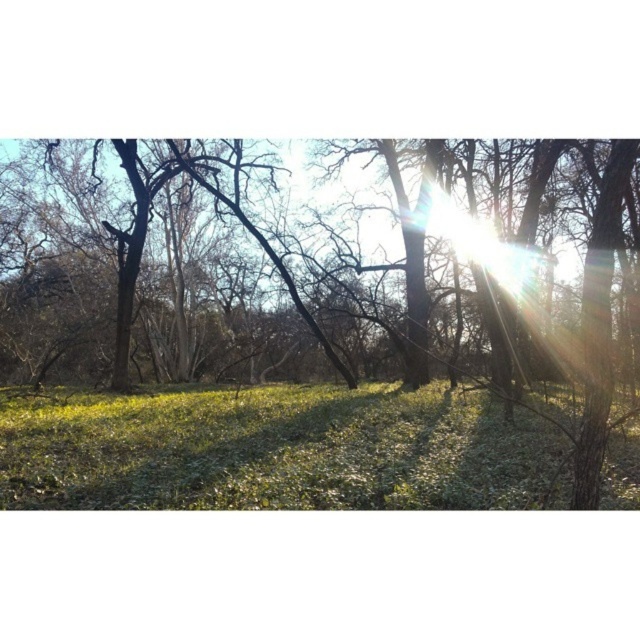
You are standing in the forest and see the green leafy tree at center and the green matte grass at center. Which object is positioned to the left?

The green leafy tree at center is positioned to the left of the green matte grass at center.

You are a hiker who wants to place a small tent on the green matte grass at center. However, there is a green leafy tree at center above it. Will the tree block sunlight from reaching the tent during the day?

The green leafy tree at center is positioned over green matte grass at center, so it will block some sunlight from reaching the tent placed there during the day.

You are a hiker trying to navigate through the forest. You notice a green leafy tree at center and green matte grass at center. Which one has a wider spread in terms of width?

The green leafy tree at center has a larger width than the green matte grass at center.